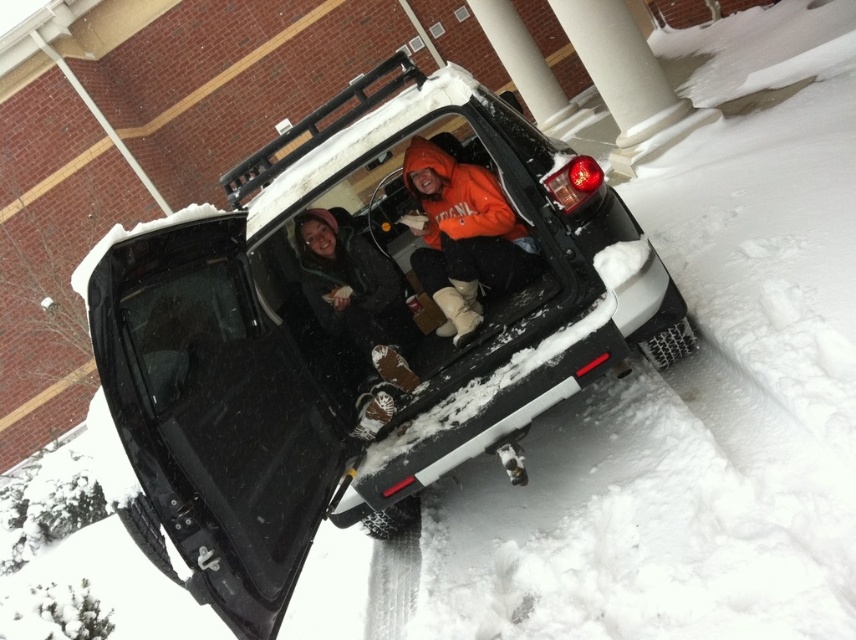
Question: Which point is farther to the camera?

Choices:
 (A) (210, 353)
 (B) (324, 241)
 (C) (498, 186)

Answer: (B)

Question: Is black matte truck at center to the left of orange fleece jacket at center from the viewer's perspective?

Choices:
 (A) yes
 (B) no

Answer: (A)

Question: Which point is farther from the camera taking this photo?

Choices:
 (A) (403, 324)
 (B) (266, 291)

Answer: (A)

Question: Is black matte truck at center bigger than matte black jacket at center?

Choices:
 (A) yes
 (B) no

Answer: (A)

Question: Is black matte truck at center thinner than matte black jacket at center?

Choices:
 (A) no
 (B) yes

Answer: (A)

Question: Which object appears farthest from the camera in this image?

Choices:
 (A) black matte truck at center
 (B) orange fleece jacket at center

Answer: (B)